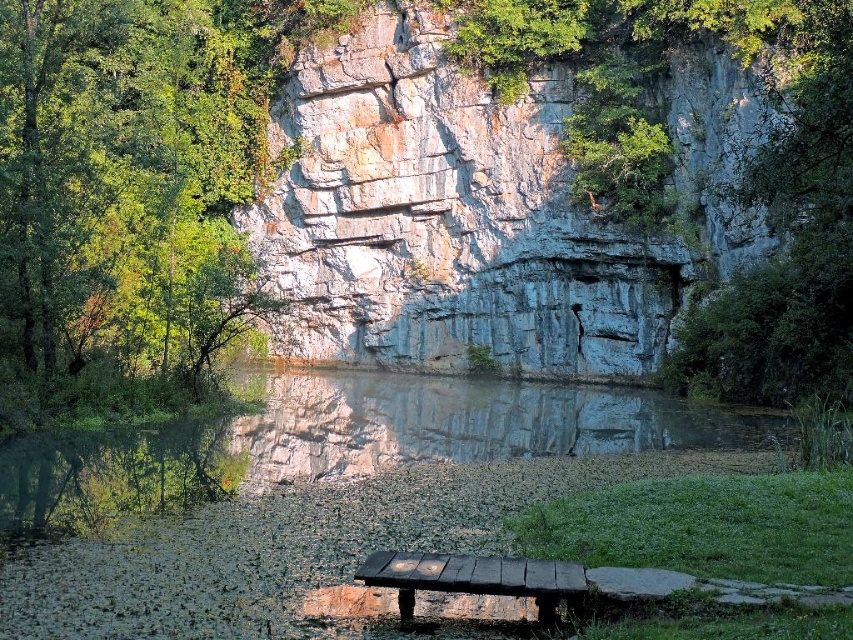
Who is shorter, green leafy tree at upper left or charcoal wood bench at lower center?

Standing shorter between the two is charcoal wood bench at lower center.

Based on the photo, is green leafy tree at upper left to the right of charcoal wood bench at lower center from the viewer's perspective?

No, green leafy tree at upper left is not to the right of charcoal wood bench at lower center.

Does point (196, 364) come closer to viewer compared to point (409, 572)?

No, (196, 364) is further to viewer.

Image resolution: width=853 pixels, height=640 pixels. Identify the location of green leafy tree at upper left. (122, 186).